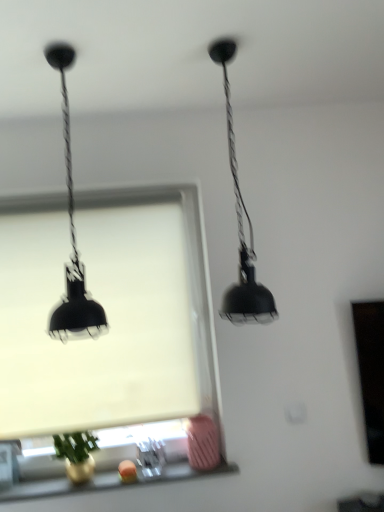
What do you see at coordinates (241, 226) in the screenshot? This screenshot has height=512, width=384. I see `black matte pendant light at upper center, positioned as the 1th lamp in right-to-left order` at bounding box center [241, 226].

The image size is (384, 512). I want to click on white matte window screen at center, so click(x=104, y=309).

I want to click on matte glass window sill at lower center, so click(x=108, y=481).

Consider the image. Choose the correct answer: Is black matte pendant light at upper center, which is counted as the second lamp, starting from the left, inside white matte window screen at center or outside it?

The correct answer is: outside.

Consider the image. From a real-world perspective, who is located lower, black matte pendant light at upper center, which is counted as the second lamp, starting from the left, or white matte window screen at center?

In real-world perspective, white matte window screen at center is lower.

Looking at their sizes, would you say black matte pendant light at upper center, which is counted as the second lamp, starting from the left, is wider or thinner than white matte window screen at center?

black matte pendant light at upper center, which is counted as the second lamp, starting from the left, is wider than white matte window screen at center.

Between black matte pendant light at upper center, positioned as the 1th lamp in right-to-left order, and white matte window screen at center, which one appears on the left side from the viewer's perspective?

From the viewer's perspective, white matte window screen at center appears more on the left side.

Is the position of white matte window screen at center less distant than that of matte black lamp at left, the first lamp viewed from the left?

No.

What's the angular difference between white matte window screen at center and matte black lamp at left, the first lamp viewed from the left,'s facing directions?

There is a 0.714-degree angle between the facing directions of white matte window screen at center and matte black lamp at left, the first lamp viewed from the left.

Is white matte window screen at center placed right next to matte black lamp at left, acting as the second lamp starting from the right?

white matte window screen at center is not next to matte black lamp at left, acting as the second lamp starting from the right, and they're not touching.

Between point (114, 295) and point (69, 320), which one is positioned in front?

The point (69, 320) is more forward.

Considering the relative positions of black matte pendant light at upper center, positioned as the 1th lamp in right-to-left order, and matte black lamp at left, the first lamp viewed from the left, in the image provided, is black matte pendant light at upper center, positioned as the 1th lamp in right-to-left order, to the right of matte black lamp at left, the first lamp viewed from the left, from the viewer's perspective?

Yes.

Where is `lamp that is above the matte black lamp at left, the first lamp viewed from the left (from the image's perspective)`? The image size is (384, 512). lamp that is above the matte black lamp at left, the first lamp viewed from the left (from the image's perspective) is located at coordinates (241, 226).

Is point (253, 246) positioned in front of point (81, 284)?

No, (253, 246) is behind (81, 284).

Consider the image. From a real-world perspective, is black matte pendant light at upper center, which is counted as the second lamp, starting from the left, physically above matte black lamp at left, the first lamp viewed from the left?

Incorrect, from a real-world perspective, black matte pendant light at upper center, which is counted as the second lamp, starting from the left, is lower than matte black lamp at left, the first lamp viewed from the left.

In the scene shown: Considering the sizes of objects matte glass window sill at lower center and matte black lamp at left, the first lamp viewed from the left, in the image provided, who is wider, matte glass window sill at lower center or matte black lamp at left, the first lamp viewed from the left,?

matte black lamp at left, the first lamp viewed from the left, is wider.

Can we say matte glass window sill at lower center lies outside matte black lamp at left, the first lamp viewed from the left?

That's correct, matte glass window sill at lower center is outside of matte black lamp at left, the first lamp viewed from the left.

You are a GUI agent. You are given a task and a screenshot of the screen. Output one action in this format:
    pyautogui.click(x=<x>, y=<y>)
    Task: Click on the lamp that is the 1st object located above the matte glass window sill at lower center (from the image's perspective)
    
    Given the screenshot: What is the action you would take?
    pyautogui.click(x=72, y=234)

From the image's perspective, is matte glass window sill at lower center over matte black lamp at left, acting as the second lamp starting from the right?

Incorrect, from the image's perspective, matte glass window sill at lower center is lower than matte black lamp at left, acting as the second lamp starting from the right.

Which object is wider, matte glass window sill at lower center or black matte pendant light at upper center, positioned as the 1th lamp in right-to-left order?

Wider between the two is black matte pendant light at upper center, positioned as the 1th lamp in right-to-left order.

Would you say matte glass window sill at lower center is inside or outside black matte pendant light at upper center, which is counted as the second lamp, starting from the left?

matte glass window sill at lower center is not inside black matte pendant light at upper center, which is counted as the second lamp, starting from the left, it's outside.

How different are the orientations of matte glass window sill at lower center and black matte pendant light at upper center, which is counted as the second lamp, starting from the left, in degrees?

They differ by 0.000125 degrees in their facing directions.

Is matte glass window sill at lower center beside black matte pendant light at upper center, positioned as the 1th lamp in right-to-left order?

No, matte glass window sill at lower center is not making contact with black matte pendant light at upper center, positioned as the 1th lamp in right-to-left order.

From the image's perspective, which one is positioned higher, matte black lamp at left, the first lamp viewed from the left, or white matte window screen at center?

matte black lamp at left, the first lamp viewed from the left, from the image's perspective.

Is matte black lamp at left, acting as the second lamp starting from the right, turned away from white matte window screen at center?

Correct, matte black lamp at left, acting as the second lamp starting from the right, is looking away from white matte window screen at center.

Considering the relative sizes of matte black lamp at left, acting as the second lamp starting from the right, and white matte window screen at center in the image provided, is matte black lamp at left, acting as the second lamp starting from the right, bigger than white matte window screen at center?

Yes.

Considering the relative sizes of matte black lamp at left, acting as the second lamp starting from the right, and white matte window screen at center in the image provided, is matte black lamp at left, acting as the second lamp starting from the right, taller than white matte window screen at center?

Incorrect, the height of matte black lamp at left, acting as the second lamp starting from the right, is not larger of that of white matte window screen at center.

Does white matte window screen at center have a lesser width compared to black matte pendant light at upper center, positioned as the 1th lamp in right-to-left order?

Yes, white matte window screen at center is thinner than black matte pendant light at upper center, positioned as the 1th lamp in right-to-left order.

From a real-world perspective, is white matte window screen at center positioned above or below black matte pendant light at upper center, positioned as the 1th lamp in right-to-left order?

In terms of real-world spatial position, white matte window screen at center is below black matte pendant light at upper center, positioned as the 1th lamp in right-to-left order.

Is white matte window screen at center positioned far away from black matte pendant light at upper center, positioned as the 1th lamp in right-to-left order?

No, there isn't a large distance between white matte window screen at center and black matte pendant light at upper center, positioned as the 1th lamp in right-to-left order.

Based on the photo, is black matte pendant light at upper center, which is counted as the second lamp, starting from the left, at the back of white matte window screen at center?

No, white matte window screen at center's orientation is not away from black matte pendant light at upper center, which is counted as the second lamp, starting from the left.

There is a white matte window screen at center. Identify the location of the 1st lamp above it (from a real-world perspective). pos(241,226).

Identify the location of window screen below the matte black lamp at left, acting as the second lamp starting from the right (from the image's perspective). The image size is (384, 512). (104, 309).

Looking at the image, which one is located closer to matte glass window sill at lower center, white matte window screen at center or black matte pendant light at upper center, which is counted as the second lamp, starting from the left?

white matte window screen at center lies closer to matte glass window sill at lower center than the other object.

From the image, which object appears to be farther from white matte window screen at center, matte glass window sill at lower center or matte black lamp at left, the first lamp viewed from the left?

matte glass window sill at lower center is positioned further to the anchor white matte window screen at center.

Based on their spatial positions, is matte black lamp at left, acting as the second lamp starting from the right, or white matte window screen at center closer to matte glass window sill at lower center?

white matte window screen at center.

Based on their spatial positions, is black matte pendant light at upper center, positioned as the 1th lamp in right-to-left order, or matte black lamp at left, acting as the second lamp starting from the right, closer to white matte window screen at center?

matte black lamp at left, acting as the second lamp starting from the right, is positioned closer to the anchor white matte window screen at center.

Estimate the real-world distances between objects in this image. Which object is further from black matte pendant light at upper center, which is counted as the second lamp, starting from the left, white matte window screen at center or matte glass window sill at lower center?

matte glass window sill at lower center lies further to black matte pendant light at upper center, which is counted as the second lamp, starting from the left, than the other object.

From the image, which object appears to be farther from matte glass window sill at lower center, white matte window screen at center or matte black lamp at left, the first lamp viewed from the left?

matte black lamp at left, the first lamp viewed from the left.

In the scene shown: Considering their positions, is white matte window screen at center positioned closer to matte black lamp at left, the first lamp viewed from the left, than matte glass window sill at lower center?

white matte window screen at center.

Looking at the image, which one is located closer to white matte window screen at center, black matte pendant light at upper center, which is counted as the second lamp, starting from the left, or matte glass window sill at lower center?

Among the two, matte glass window sill at lower center is located nearer to white matte window screen at center.

Identify the location of lamp between black matte pendant light at upper center, which is counted as the second lamp, starting from the left, and matte glass window sill at lower center vertically. [72, 234].

Find the location of a particular element. The height and width of the screenshot is (512, 384). lamp located between matte black lamp at left, the first lamp viewed from the left, and white matte window screen at center in the depth direction is located at coordinates (241, 226).

You are a GUI agent. You are given a task and a screenshot of the screen. Output one action in this format:
    pyautogui.click(x=<x>, y=<y>)
    Task: Click on the window screen between black matte pendant light at upper center, positioned as the 1th lamp in right-to-left order, and matte glass window sill at lower center in the up-down direction
    
    Given the screenshot: What is the action you would take?
    pyautogui.click(x=104, y=309)

At what (x,y) coordinates should I click in order to perform the action: click on window screen between matte black lamp at left, the first lamp viewed from the left, and matte glass window sill at lower center from top to bottom. Please return your answer as a coordinate pair (x, y). The width and height of the screenshot is (384, 512). Looking at the image, I should click on pos(104,309).